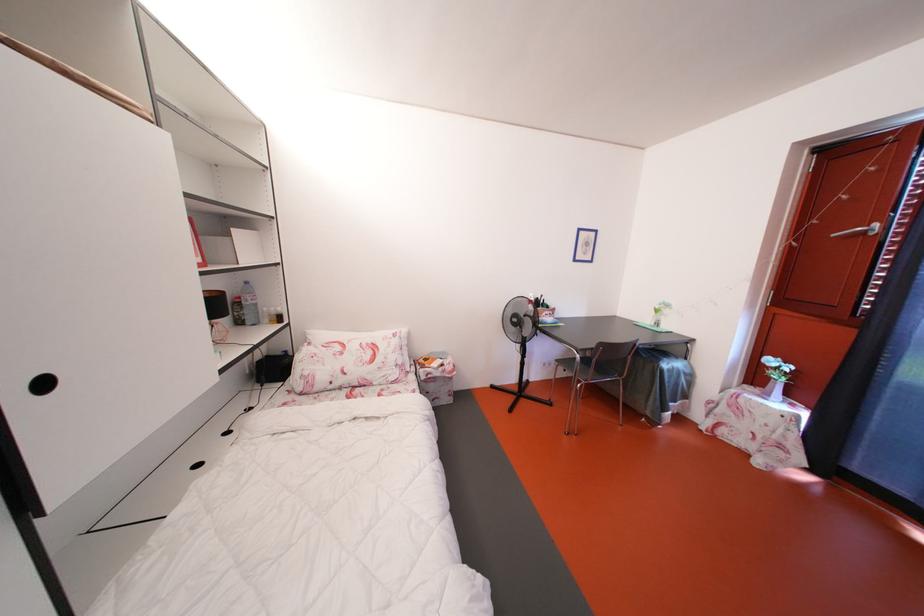
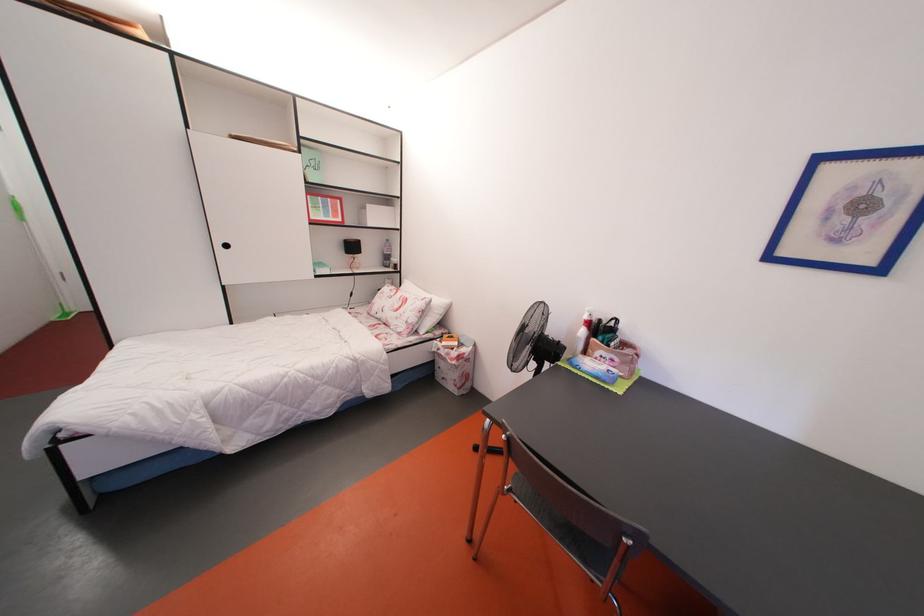
Locate, in the second image, the point that corresponds to [407,368] in the first image.

(417, 326)